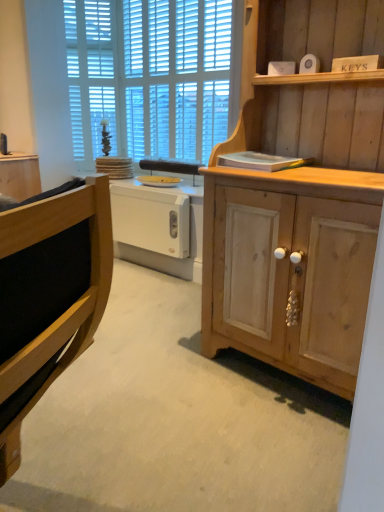
What are the coordinates of `free space above white plastic drawer at center (from a real-world perspective)` in the screenshot? It's located at (134, 186).